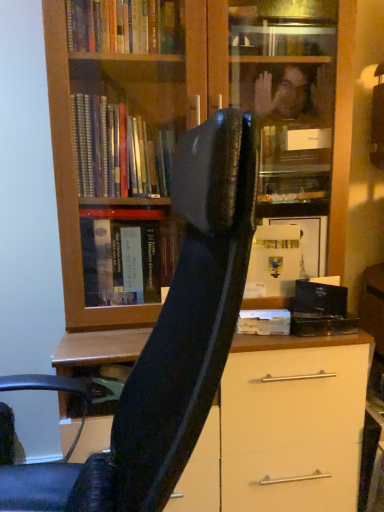
Question: From a real-world perspective, is wooden bookcase at center under black leather chair at center?

Choices:
 (A) yes
 (B) no

Answer: (B)

Question: From the image's perspective, is wooden bookcase at center beneath black leather chair at center?

Choices:
 (A) yes
 (B) no

Answer: (B)

Question: Is wooden bookcase at center far away from black leather chair at center?

Choices:
 (A) no
 (B) yes

Answer: (A)

Question: Could black leather chair at center be considered to be inside wooden bookcase at center?

Choices:
 (A) yes
 (B) no

Answer: (B)

Question: Does wooden bookcase at center have a lesser width compared to black leather chair at center?

Choices:
 (A) yes
 (B) no

Answer: (A)

Question: In terms of width, does black leather chair at center look wider or thinner when compared to white matte paper at center?

Choices:
 (A) wide
 (B) thin

Answer: (A)

Question: Is black leather chair at center taller or shorter than white matte paper at center?

Choices:
 (A) tall
 (B) short

Answer: (A)

Question: Considering the positions of point (36, 465) and point (241, 327), is point (36, 465) closer or farther from the camera than point (241, 327)?

Choices:
 (A) closer
 (B) farther

Answer: (A)

Question: Which is correct: black leather chair at center is inside white matte paper at center, or outside of it?

Choices:
 (A) inside
 (B) outside

Answer: (B)

Question: Is white matte paper at center to the left or to the right of wooden bookcase at center in the image?

Choices:
 (A) right
 (B) left

Answer: (A)

Question: Does point (261, 321) appear closer or farther from the camera than point (266, 157)?

Choices:
 (A) farther
 (B) closer

Answer: (B)

Question: Considering the positions of white matte paper at center and wooden bookcase at center in the image, is white matte paper at center taller or shorter than wooden bookcase at center?

Choices:
 (A) short
 (B) tall

Answer: (A)

Question: From the image's perspective, is white matte paper at center positioned above or below wooden bookcase at center?

Choices:
 (A) below
 (B) above

Answer: (A)

Question: Is wooden bookcase at center taller or shorter than black leather chair at center?

Choices:
 (A) short
 (B) tall

Answer: (B)

Question: In terms of width, does wooden bookcase at center look wider or thinner when compared to black leather chair at center?

Choices:
 (A) wide
 (B) thin

Answer: (B)